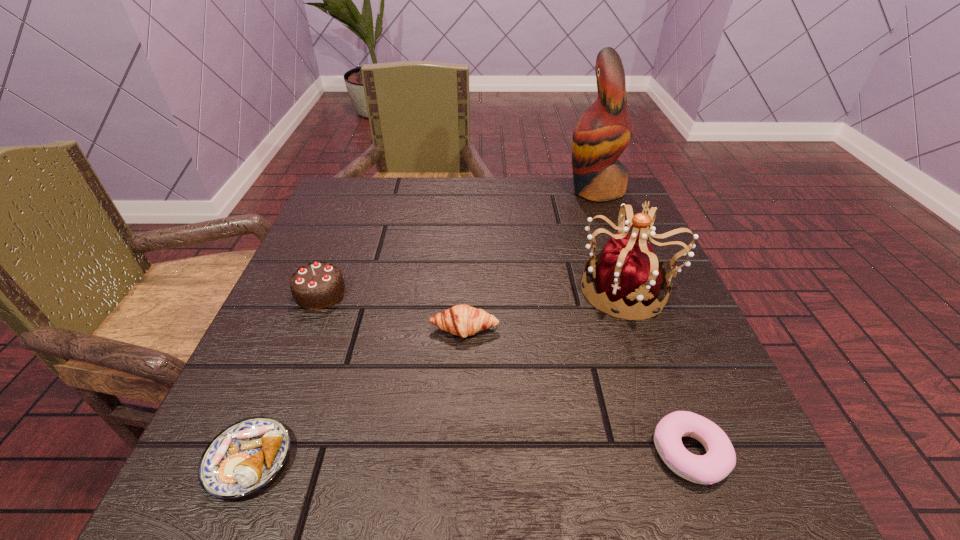
Identify the location of the tallest object. click(x=601, y=135).

Locate an element on the screen. parrot is located at coordinates (601, 135).

Locate an element on the screen. This screenshot has height=540, width=960. tiara is located at coordinates [x=627, y=273].

The width and height of the screenshot is (960, 540). In order to click on chocolate cake in this screenshot , I will do [317, 285].

The image size is (960, 540). Find the location of `the third object from left to right`. the third object from left to right is located at coordinates (462, 320).

What are the coordinates of `the farthest pastry` in the screenshot? It's located at (462, 320).

Locate an element on the screen. the leftmost pastry is located at coordinates 243,458.

Where is `the rightmost pastry`? The height and width of the screenshot is (540, 960). the rightmost pastry is located at coordinates (720, 458).

Image resolution: width=960 pixels, height=540 pixels. I want to click on vacant area situated 0.220m on the face of the farthest object, so click(x=477, y=190).

Image resolution: width=960 pixels, height=540 pixels. I want to click on vacant space located 0.080m on the face of the farthest object, so click(533, 190).